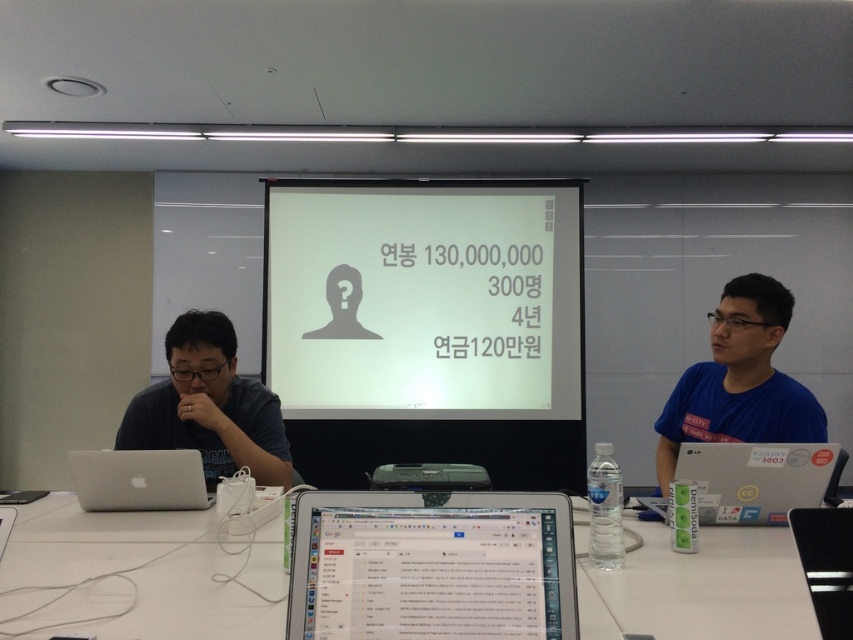
Question: Is blue t-shirt at right wider than silver metallic laptop at right?

Choices:
 (A) yes
 (B) no

Answer: (B)

Question: Among these objects, which one is nearest to the camera?

Choices:
 (A) silver metallic laptop at right
 (B) silver metallic laptop at lower left
 (C) blue t-shirt at right

Answer: (A)

Question: Does white plastic table at center appear under matte black projector at center?

Choices:
 (A) yes
 (B) no

Answer: (B)

Question: Is white plastic table at center smaller than dark gray shirt at left?

Choices:
 (A) no
 (B) yes

Answer: (A)

Question: Estimate the real-world distances between objects in this image. Which object is closer to the blue t-shirt at right?

Choices:
 (A) white plastic table at center
 (B) matte black projector at center

Answer: (B)

Question: Among these objects, which one is farthest from the camera?

Choices:
 (A) blue t-shirt at right
 (B) matte black projector at center

Answer: (B)